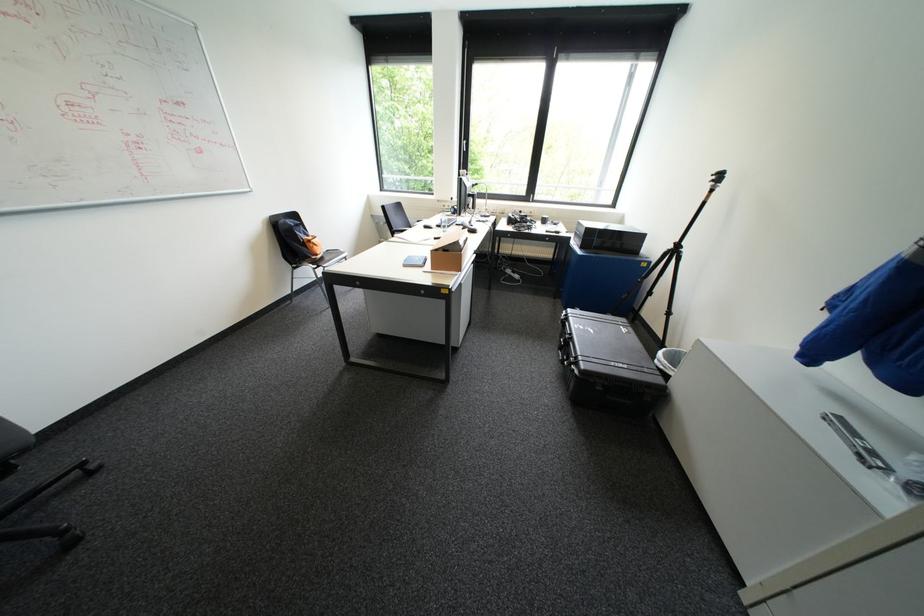
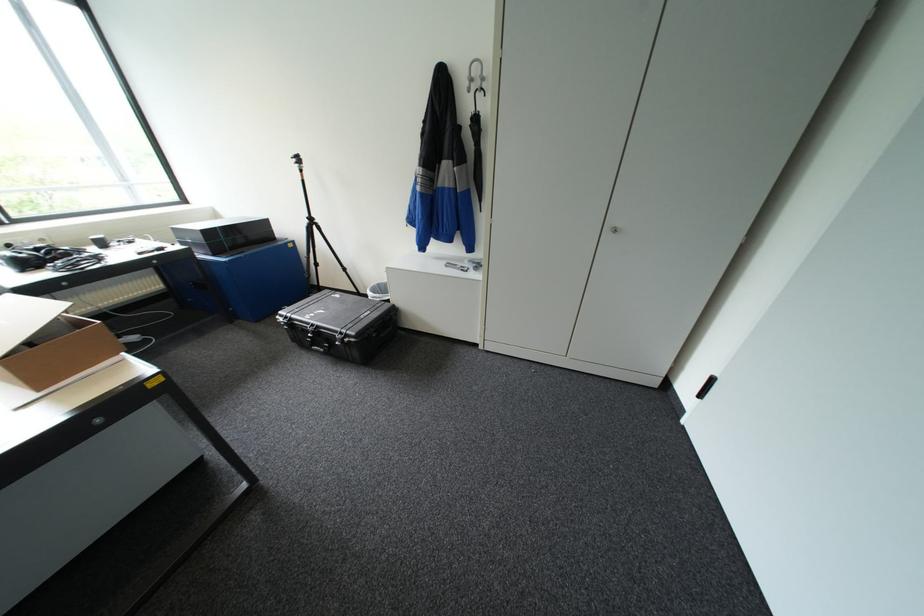
The first image is from the beginning of the video and the second image is from the end. How did the camera likely rotate when shooting the video?

The rotation direction of the camera is right-down.